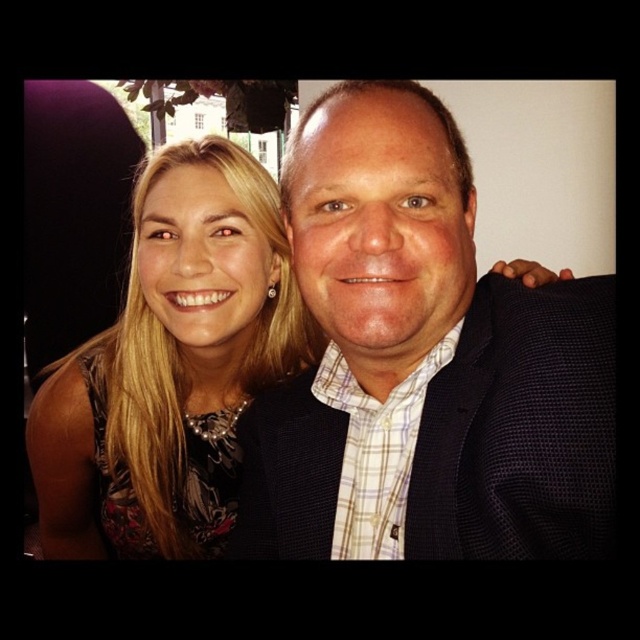
You are a photographer trying to capture a closeup shot of both the matte black suit at center and the matte black dress at left. Given that your camera has a depth of field that can focus clearly on objects within a 12 inch range, will both items be in focus?

The matte black suit at center is 13.46 inches away from the matte black dress at left. Since the distance between them exceeds the camera lens depth of field range of 12 inches, only one of them will be in focus at a time.

You are standing in the same room as the people in the image. You want to place a small table exactly where the matte black suit at center is located. What are the coordinates where you should place the table?

The coordinates for placing the table should be at point (424,364), where the matte black suit at center is located.